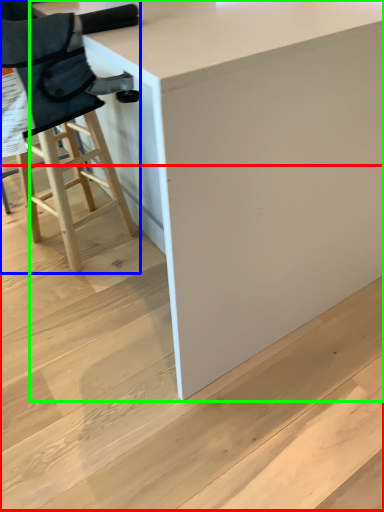
Question: Based on their relative distances, which object is nearer to stair (highlighted by a red box)? Choose from chair (highlighted by a blue box) and table (highlighted by a green box).

Choices:
 (A) chair
 (B) table

Answer: (B)